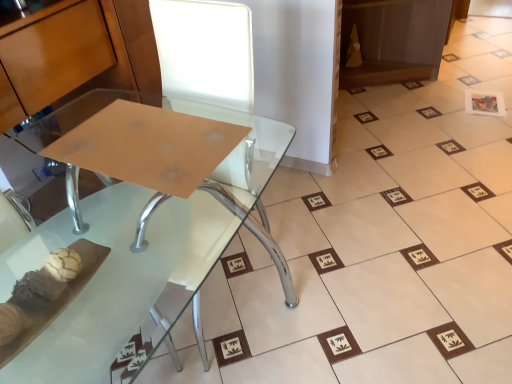
This screenshot has height=384, width=512. I want to click on free space above clear glass table at center (from a real-world perspective), so click(x=145, y=139).